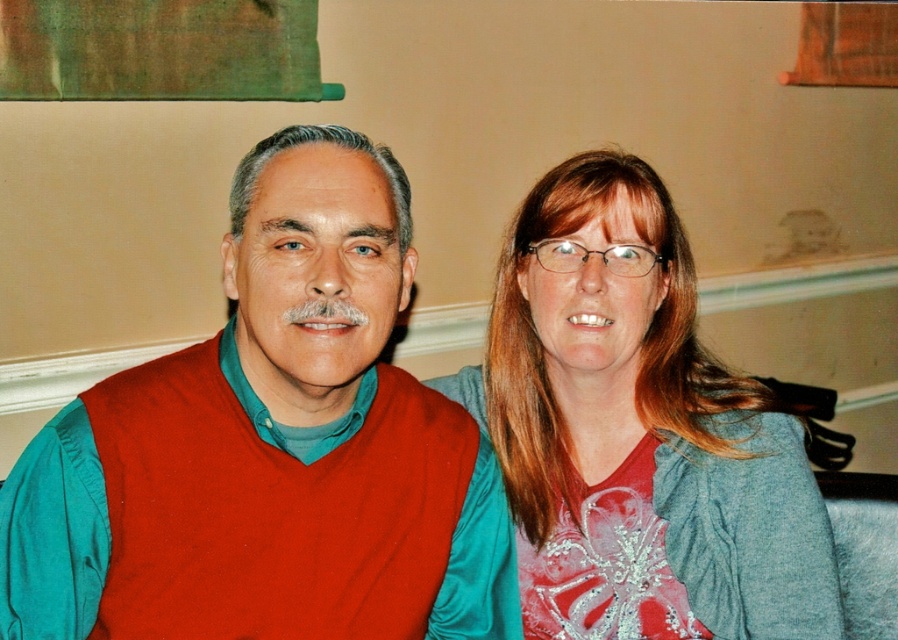
Question: Does matte red shirt at center have a larger size compared to matte red vest at center?

Choices:
 (A) no
 (B) yes

Answer: (B)

Question: From the image, what is the correct spatial relationship of matte red shirt at center in relation to matte red vest at center?

Choices:
 (A) above
 (B) below

Answer: (B)

Question: Which point is closer to the camera?

Choices:
 (A) matte red shirt at center
 (B) matte red vest at center

Answer: (B)

Question: Which object is closer to the camera taking this photo?

Choices:
 (A) matte red vest at center
 (B) matte red shirt at center

Answer: (A)

Question: Is matte red shirt at center thinner than matte red vest at center?

Choices:
 (A) yes
 (B) no

Answer: (B)

Question: Which of the following is the closest to the observer?

Choices:
 (A) (591, 332)
 (B) (78, 630)

Answer: (B)